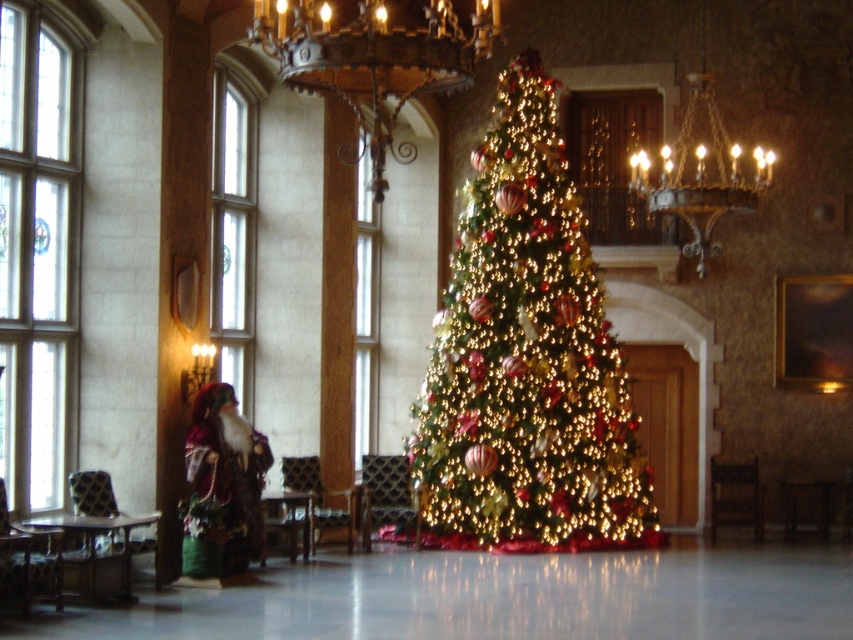
Is dark brown wrought iron chandelier at upper center above velvet plush santa at left?

Correct, dark brown wrought iron chandelier at upper center is located above velvet plush santa at left.

Can you confirm if dark brown wrought iron chandelier at upper center is positioned to the right of velvet plush santa at left?

Correct, you'll find dark brown wrought iron chandelier at upper center to the right of velvet plush santa at left.

Is point (415, 28) positioned before point (233, 563)?

No, (415, 28) is behind (233, 563).

In order to click on dark brown wrought iron chandelier at upper center in this screenshot , I will do `click(374, 60)`.

Which of these two, iridescent gold christmas tree at center or dark brown wrought iron chandelier at upper center, stands taller?

With more height is iridescent gold christmas tree at center.

Is point (451, 417) positioned in front of point (254, 1)?

No, (451, 417) is behind (254, 1).

At what (x,y) coordinates should I click in order to perform the action: click on iridescent gold christmas tree at center. Please return your answer as a coordinate pair (x, y). Image resolution: width=853 pixels, height=640 pixels. Looking at the image, I should click on (526, 360).

Who is lower down, iridescent gold christmas tree at center or velvet plush santa at left?

velvet plush santa at left

Does iridescent gold christmas tree at center have a greater height compared to velvet plush santa at left?

Yes.

Between point (460, 252) and point (213, 433), which one is positioned behind?

Positioned behind is point (460, 252).

I want to click on iridescent gold christmas tree at center, so click(x=526, y=360).